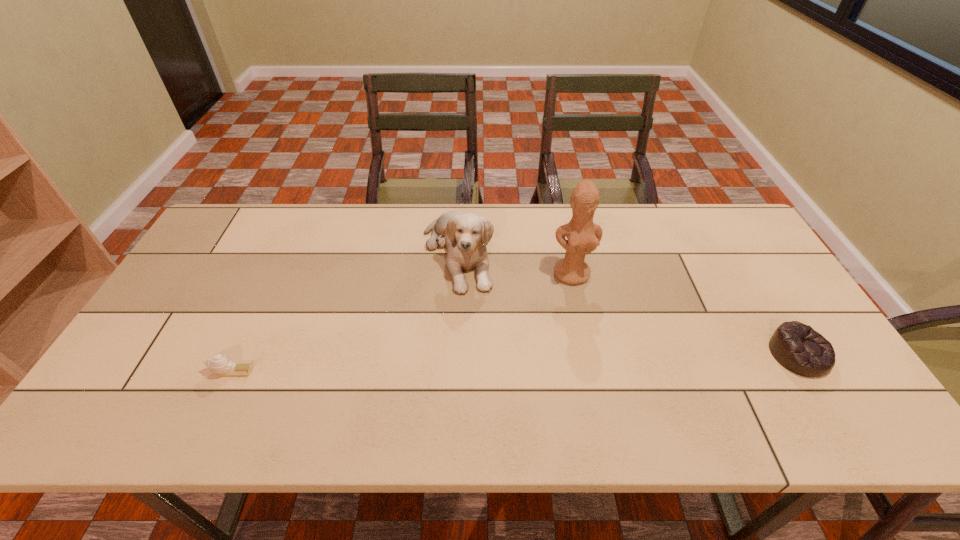
Find the location of a particular element. object that can be found as the third closest to the third object from right to left is located at coordinates (x=797, y=347).

Image resolution: width=960 pixels, height=540 pixels. I want to click on free space that satisfies the following two spatial constraints: 1. on the front side of the puppy; 2. on the left side of the rightmost object, so click(451, 354).